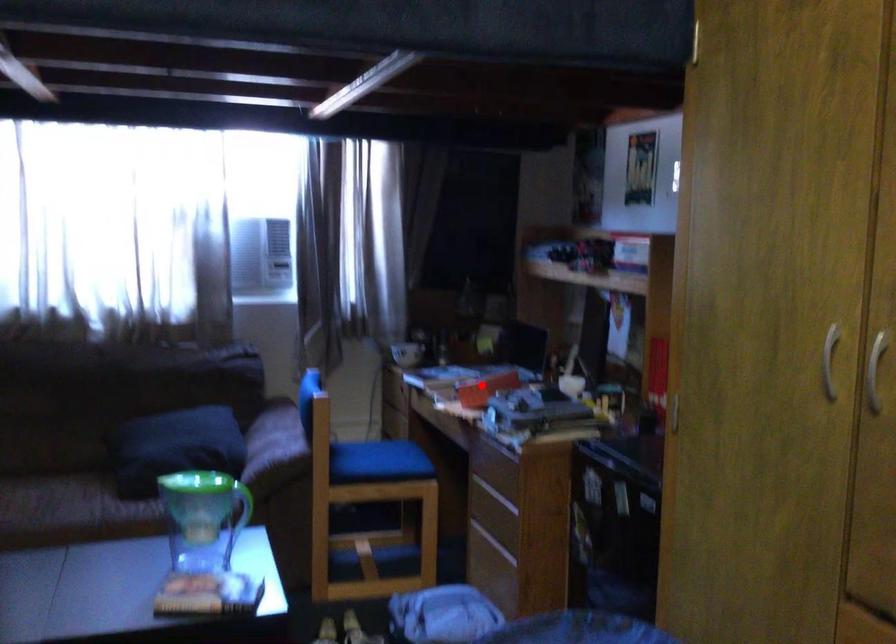
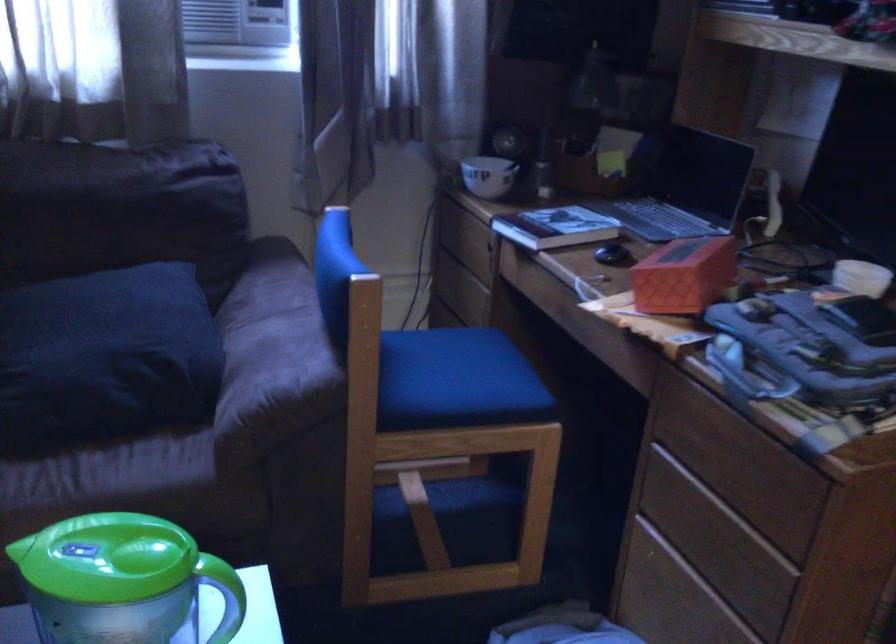
In the second image, find the point that corresponds to the highlighted location in the first image.

(684, 275)